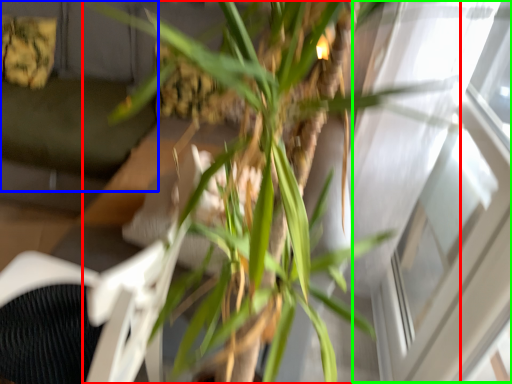
Question: Which is farther away from houseplant (highlighted by a red box)? couch (highlighted by a blue box) or window (highlighted by a green box)?

Choices:
 (A) couch
 (B) window

Answer: (A)